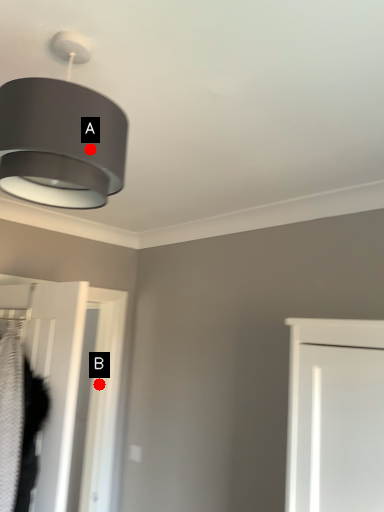
Question: Two points are circled on the image, labeled by A and B beside each circle. Which of the following is the closest to the observer?

Choices:
 (A) A is closer
 (B) B is closer

Answer: (A)